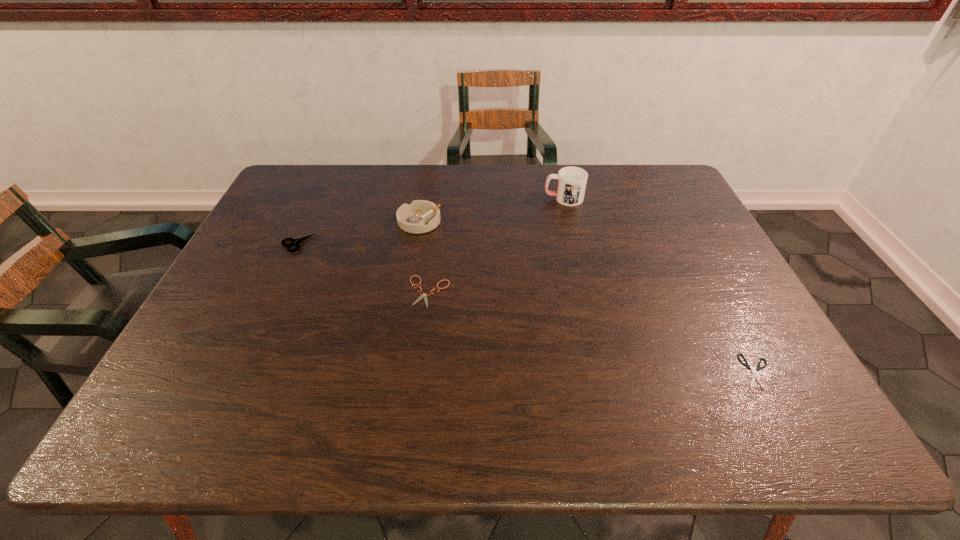
I want to click on free space located on the side of the mug with the handle, so click(449, 198).

What are the coordinates of `vacant space situated 0.130m on the side of the mug with the handle` in the screenshot? It's located at (504, 198).

Locate an element on the screen. Image resolution: width=960 pixels, height=540 pixels. free space located 0.360m on the front of the fourth shortest object is located at coordinates (401, 329).

I want to click on vacant space located 0.380m on the front of the leftmost object, so click(242, 366).

Where is `vacant space located 0.340m on the front of the second nearest shears`? The height and width of the screenshot is (540, 960). vacant space located 0.340m on the front of the second nearest shears is located at coordinates (412, 440).

Locate an element on the screen. free space located on the left of the rightmost object is located at coordinates (573, 372).

The width and height of the screenshot is (960, 540). Find the location of `object at the far edge`. object at the far edge is located at coordinates (571, 181).

Identify the location of object at the left edge. The width and height of the screenshot is (960, 540). (294, 242).

The height and width of the screenshot is (540, 960). What are the coordinates of `object that is at the right edge` in the screenshot? It's located at pos(747,365).

Image resolution: width=960 pixels, height=540 pixels. In the image, there is a desktop. In order to click on blank space at the far edge in this screenshot , I will do `click(566, 164)`.